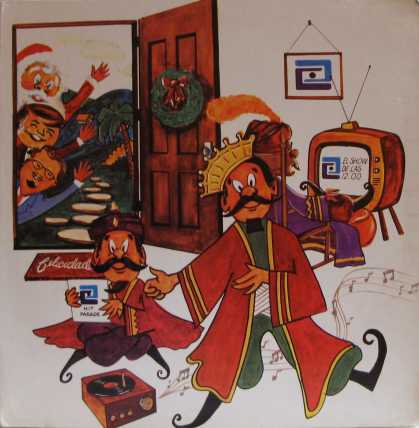
I want to click on open door entrance, so click(68, 68).